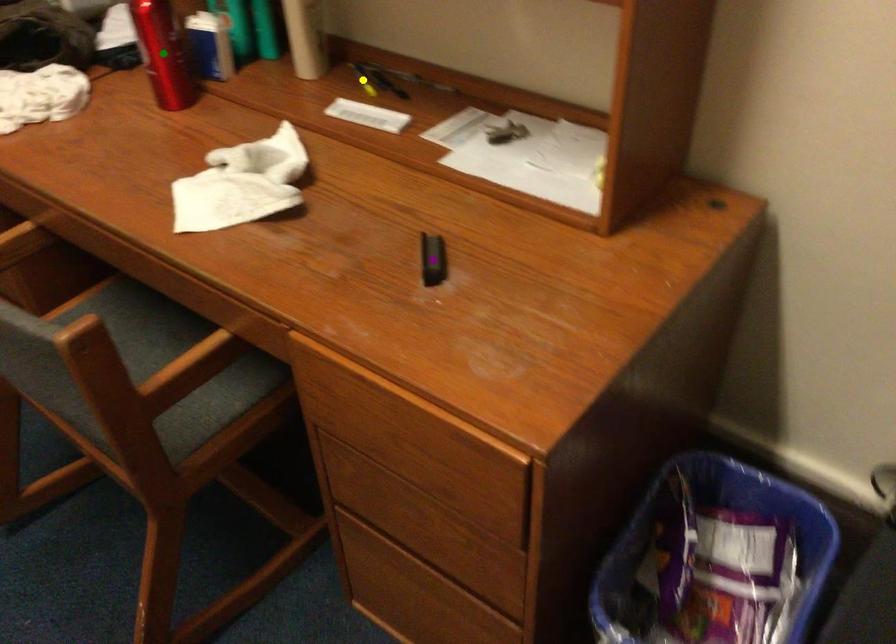
Order these from nearest to farthest:
- purple point
- green point
- yellow point

purple point
green point
yellow point